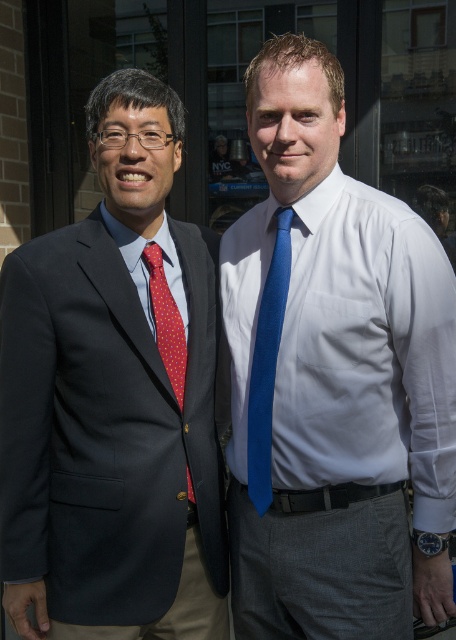
Who is taller, matte black suit at left or blue silk tie at center?

matte black suit at left

Can you confirm if matte black suit at left is thinner than blue silk tie at center?

No.

I want to click on matte black suit at left, so click(114, 400).

In the scene shown: Does blue silk tie at center come behind red dotted fabric tie at left?

No, it is in front of red dotted fabric tie at left.

Is blue silk tie at center bigger than red dotted fabric tie at left?

Yes, blue silk tie at center is bigger than red dotted fabric tie at left.

The height and width of the screenshot is (640, 456). What do you see at coordinates (267, 364) in the screenshot? I see `blue silk tie at center` at bounding box center [267, 364].

The height and width of the screenshot is (640, 456). I want to click on blue silk tie at center, so click(267, 364).

Is blue smooth tie at center above blue silk tie at center?

Correct, blue smooth tie at center is located above blue silk tie at center.

The width and height of the screenshot is (456, 640). Describe the element at coordinates (332, 380) in the screenshot. I see `blue smooth tie at center` at that location.

Does point (279, 536) come behind point (269, 381)?

Yes, it is behind point (269, 381).

Identify the location of blue smooth tie at center. (332, 380).